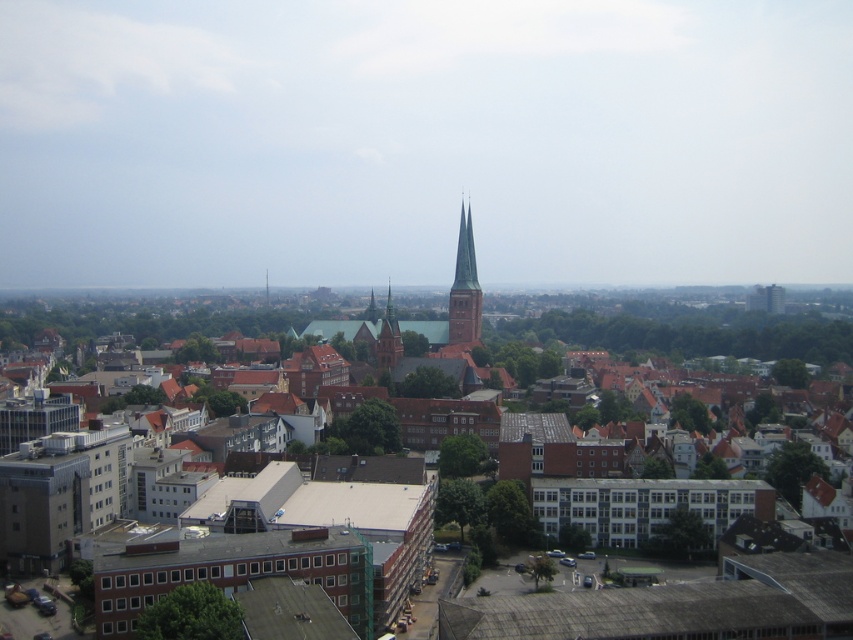
You are standing at an elevated viewpoint overlooking the city. You notice two structures in the center of the image. Which one is positioned to the right when looking at the brown brick town at center and the brown stone tower at center?

The brown brick town at center is positioned to the right of the brown stone tower at center.

You are an architect analyzing the city layout. You notice the brown brick town at center and the brown stone tower at center. Which structure is positioned lower in the image?

The brown brick town at center is located below the brown stone tower at center, so it is positioned lower in the image.